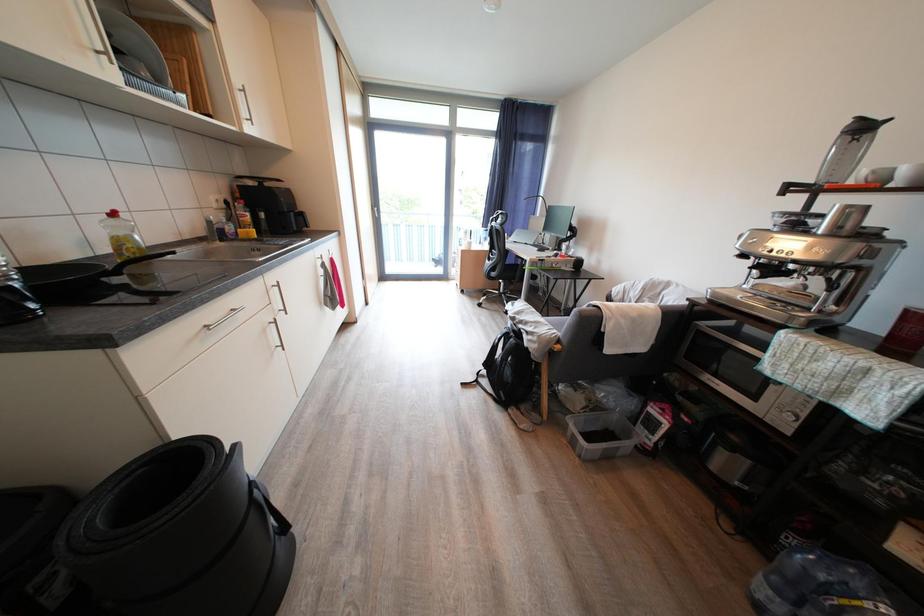
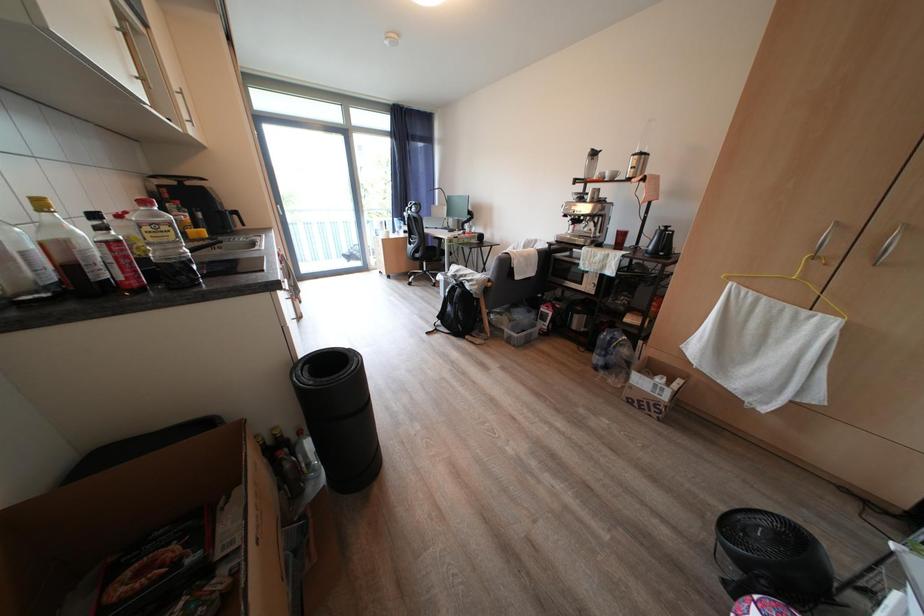
The images are taken continuously from a first-person perspective. In which direction are you moving?

The cameraman walked toward left, backward.